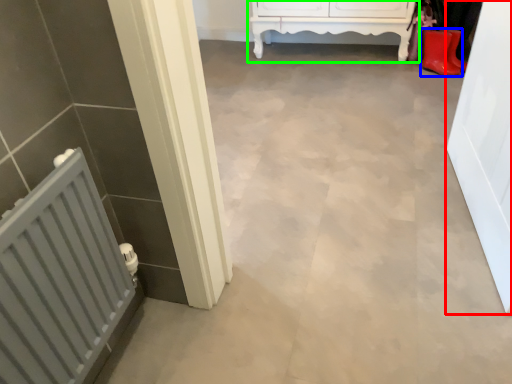
Question: Based on their relative distances, which object is nearer to door (highlighted by a red box)? Choose from footwear (highlighted by a blue box) and furniture (highlighted by a green box).

Choices:
 (A) footwear
 (B) furniture

Answer: (A)